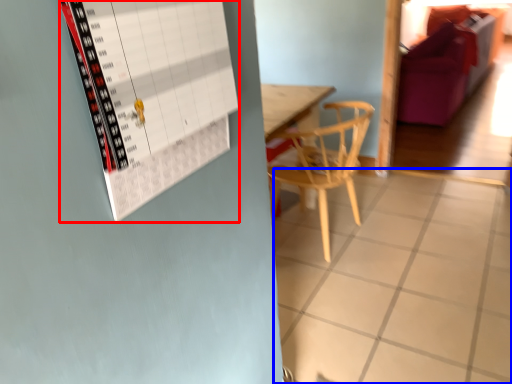
Question: Which object appears closest to the camera in this image, bulletin board (highlighted by a red box) or tile (highlighted by a blue box)?

Choices:
 (A) bulletin board
 (B) tile

Answer: (A)